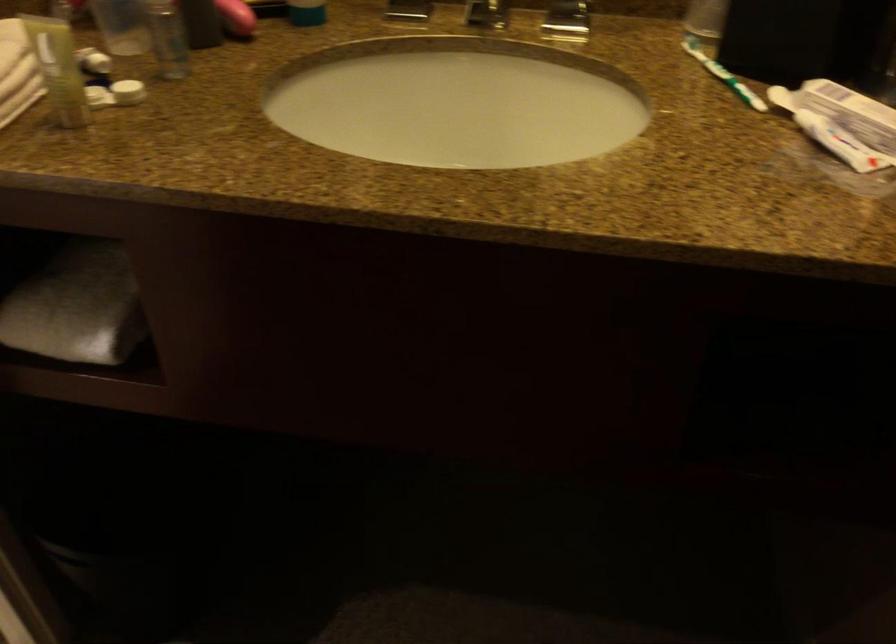
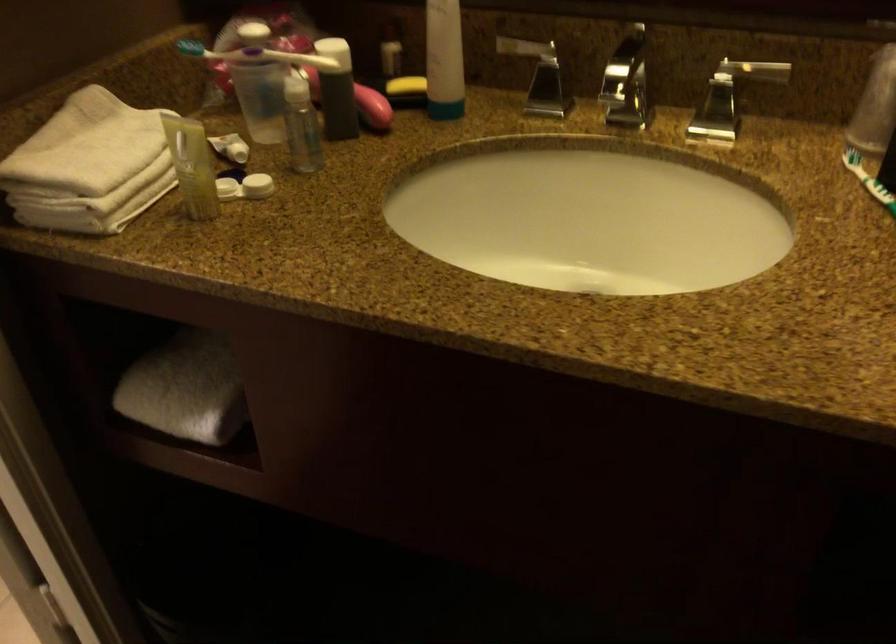
Which direction would the cameraman need to move to produce the second image?

The movement direction of the cameraman is right, forward.